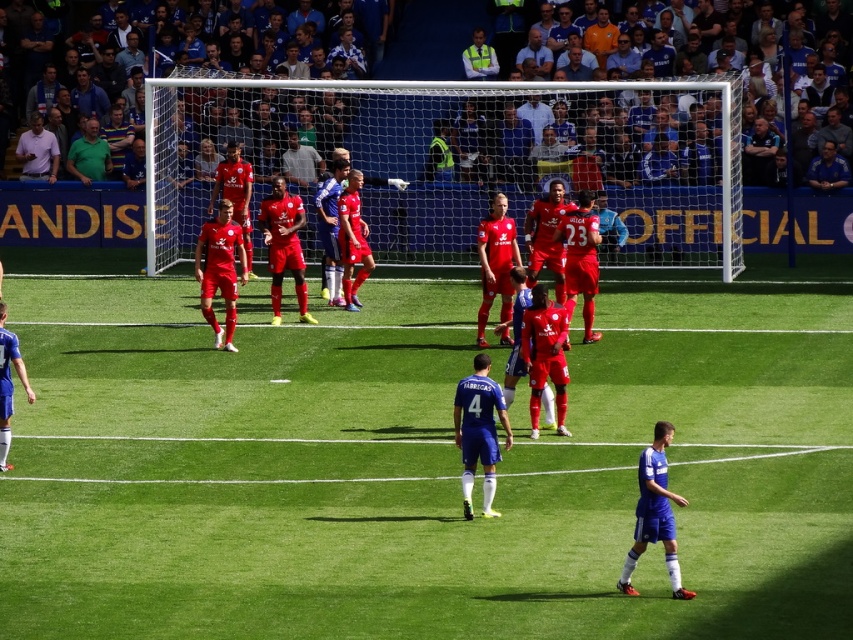
Question: Is green grass football field at center above blue matte jersey at center?

Choices:
 (A) yes
 (B) no

Answer: (A)

Question: Does white mesh net at center appear on the left side of high visibility vest at upper center?

Choices:
 (A) no
 (B) yes

Answer: (B)

Question: Which of the following is the closest to the observer?

Choices:
 (A) pyautogui.click(x=663, y=490)
 (B) pyautogui.click(x=466, y=54)
 (C) pyautogui.click(x=456, y=237)

Answer: (A)

Question: Among these points, which one is nearest to the camera?

Choices:
 (A) (44, 138)
 (B) (96, 152)
 (C) (692, 496)

Answer: (C)

Question: Is blue matte jersey at center smaller than pink shirt at upper left?

Choices:
 (A) no
 (B) yes

Answer: (B)

Question: Which of the following is the closest to the observer?

Choices:
 (A) blue fabric jersey at lower right
 (B) high visibility vest at upper center

Answer: (A)